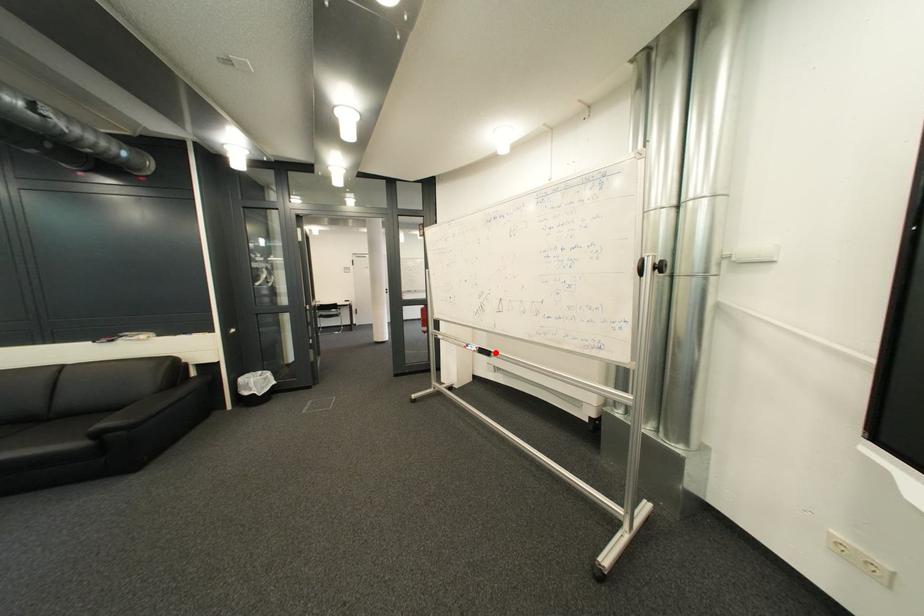
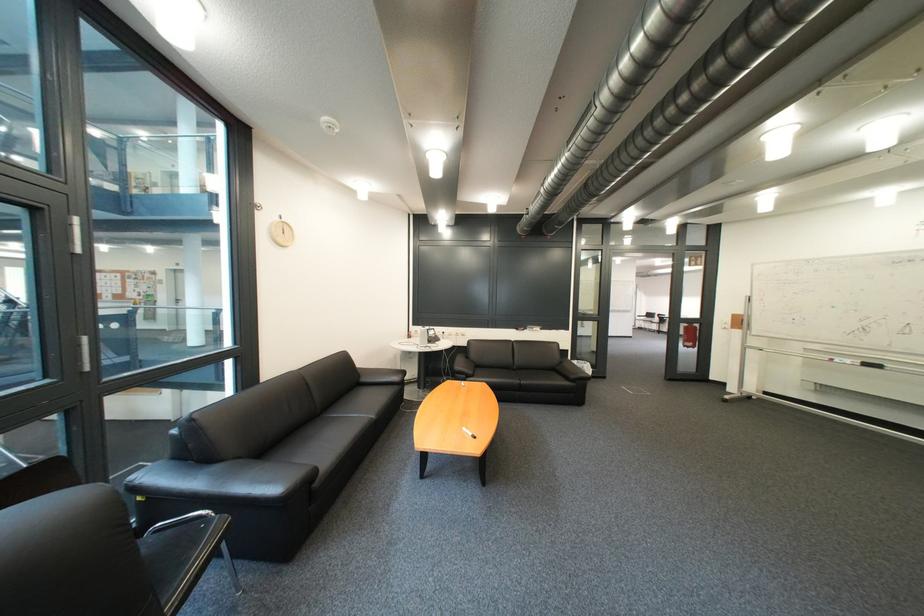
Question: I am providing you with two images of the same scene from different viewpoints. A red point is marked on the first image. Can you still see the location of the red point in image 2?

Choices:
 (A) Yes
 (B) No

Answer: (A)